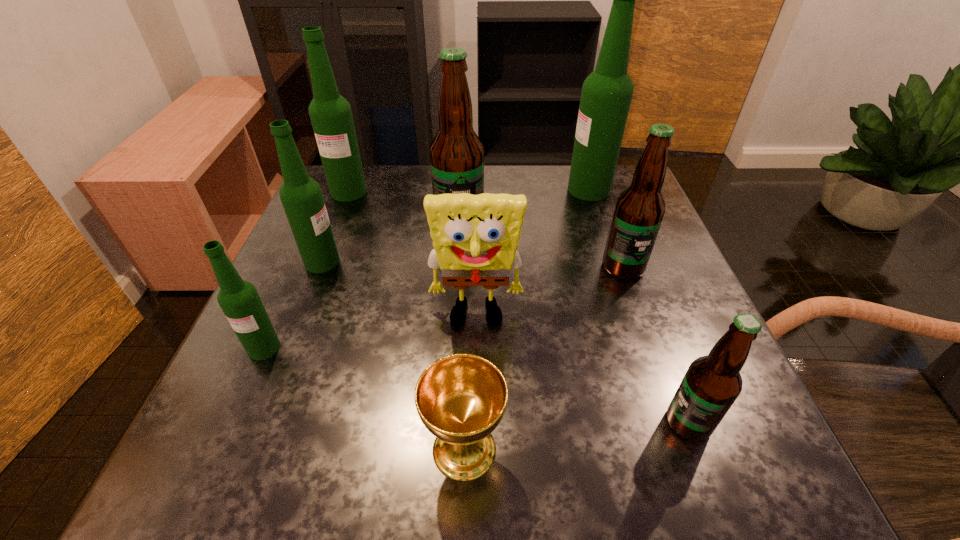
Where is `free area in between the third biggest green beer bottle and the third smallest green beer bottle`? free area in between the third biggest green beer bottle and the third smallest green beer bottle is located at coordinates (335, 227).

Identify the location of vacant region between the chalice and the rightmost green beer bottle. This screenshot has height=540, width=960. point(527,319).

Locate an element on the screen. blank region between the second farthest brown beer bottle and the tallest beer bottle is located at coordinates tap(606, 228).

Locate an element on the screen. The height and width of the screenshot is (540, 960). vacant space that's between the second nearest brown beer bottle and the biggest brown beer bottle is located at coordinates (541, 247).

In order to click on vacant space in between the second smallest brown beer bottle and the shortest object in this screenshot , I will do `click(543, 358)`.

Select which object is the seventh closest to the rightmost green beer bottle. Please provide its 2D coordinates. Your answer should be formatted as a tuple, i.e. [(x, y)], where the tuple contains the x and y coordinates of a point satisfying the conditions above.

[(461, 398)]

Locate an element on the screen. The width and height of the screenshot is (960, 540). object that is the fourth nearest to the sixth farthest beer bottle is located at coordinates (456, 153).

The image size is (960, 540). Find the location of `beer bottle that is the sixth closest to the second nearest beer bottle`. beer bottle that is the sixth closest to the second nearest beer bottle is located at coordinates (606, 95).

Point out which beer bottle is positioned as the third nearest to the second smallest brown beer bottle. Please provide its 2D coordinates. Your answer should be formatted as a tuple, i.e. [(x, y)], where the tuple contains the x and y coordinates of a point satisfying the conditions above.

[(712, 383)]

This screenshot has height=540, width=960. I want to click on green beer bottle that is the nearest to the sponge, so click(x=301, y=196).